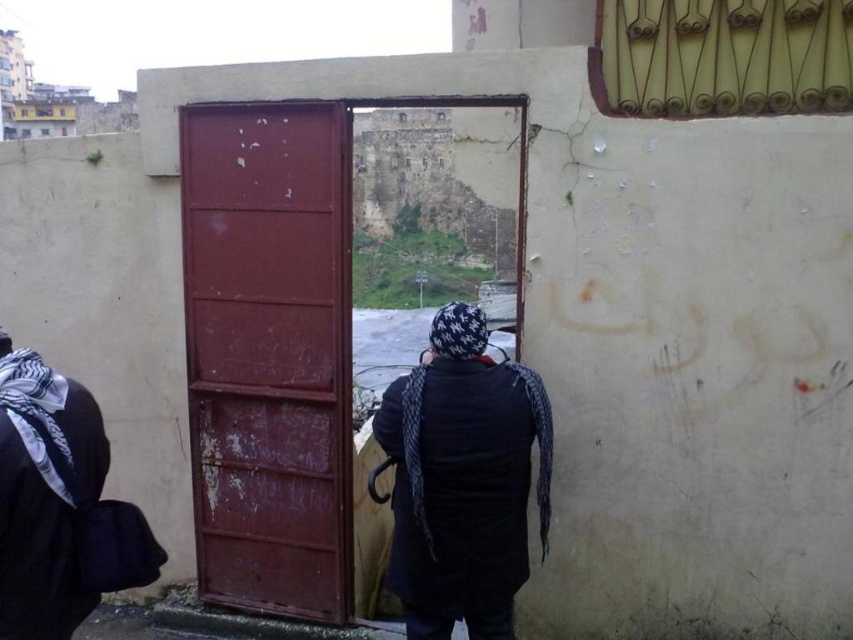
Question: Which object appears closest to the camera in this image?

Choices:
 (A) black knit cap at center
 (B) rusty metal door at center

Answer: (A)

Question: Where is rusty metal door at center located in relation to black knit cap at center in the image?

Choices:
 (A) above
 (B) below

Answer: (A)

Question: Does rusty metal door at center lie in front of black knit cap at center?

Choices:
 (A) yes
 (B) no

Answer: (B)

Question: Does rusty metal door at center appear on the right side of black knit cap at center?

Choices:
 (A) no
 (B) yes

Answer: (A)